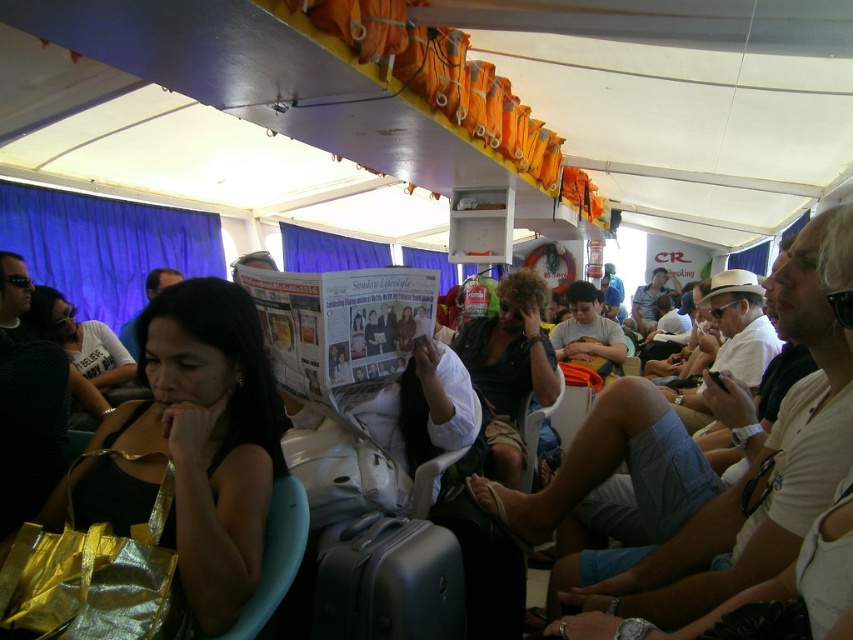
Who is taller, shiny gold bag at center or dark brown leather jacket at center?

Standing taller between the two is dark brown leather jacket at center.

Is shiny gold bag at center bigger than dark brown leather jacket at center?

Incorrect, shiny gold bag at center is not larger than dark brown leather jacket at center.

Find the location of `shiny gold bag at center`. shiny gold bag at center is located at coordinates (190, 445).